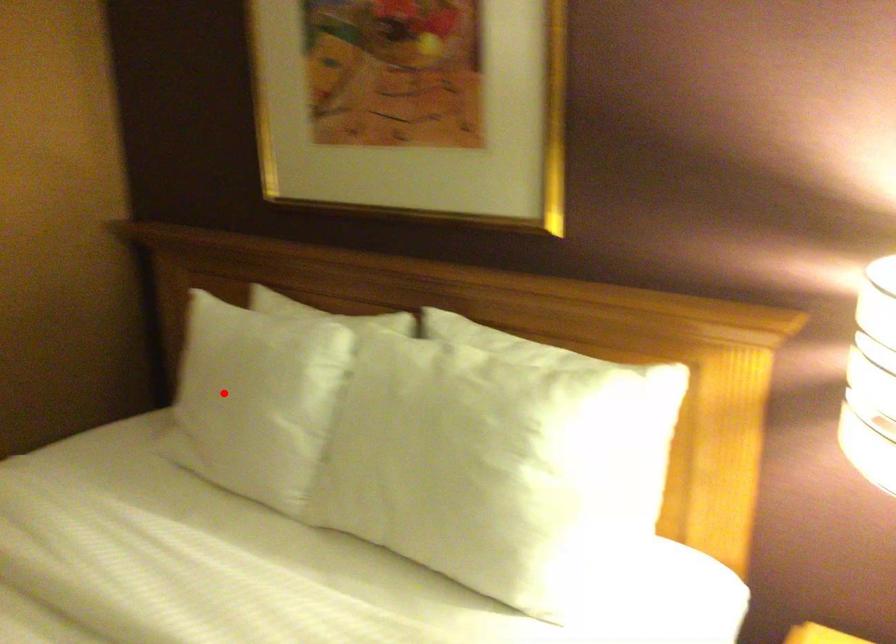
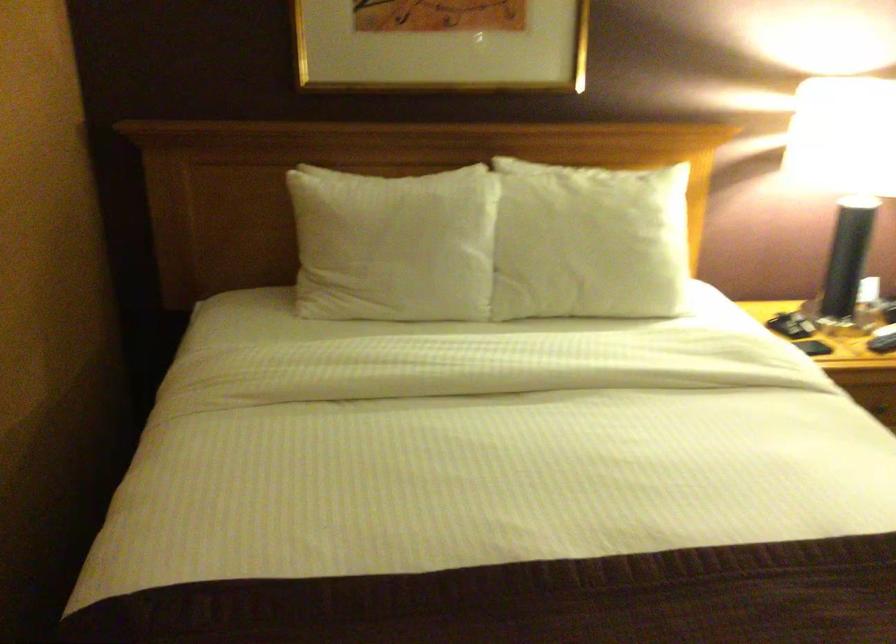
The point at the highlighted location is marked in the first image. Where is the corresponding point in the second image?

(393, 245)